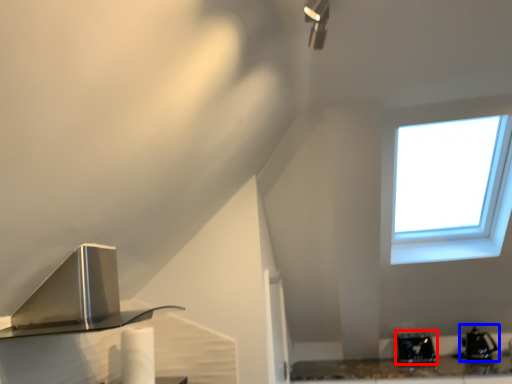
Question: Among these objects, which one is nearest to the camera, appliance (highlighted by a red box) or appliance (highlighted by a blue box)?

Choices:
 (A) appliance
 (B) appliance

Answer: (B)